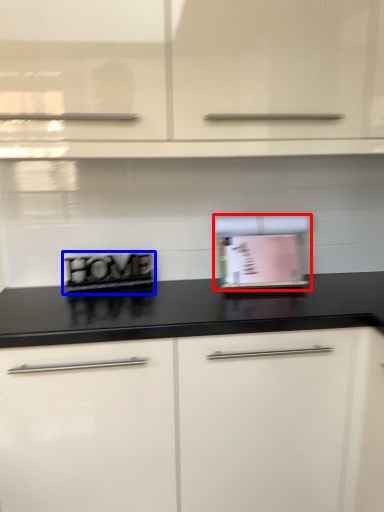
Question: Among these objects, which one is nearest to the camera, appliance (highlighted by a red box) or appliance (highlighted by a blue box)?

Choices:
 (A) appliance
 (B) appliance

Answer: (A)